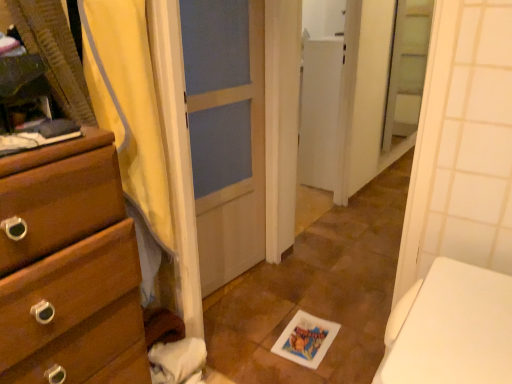
Question: Looking at their shapes, would you say wooden chest of drawers at left is wider or thinner than yellow fabric shower curtain at left?

Choices:
 (A) thin
 (B) wide

Answer: (B)

Question: Is point (117, 226) closer or farther from the camera than point (130, 140)?

Choices:
 (A) farther
 (B) closer

Answer: (B)

Question: Which object is the farthest from the yellow fabric shower curtain at left?

Choices:
 (A) wooden chest of drawers at left
 (B) clear glass screen door at upper right

Answer: (B)

Question: Considering the real-world distances, which object is closest to the clear glass screen door at upper right?

Choices:
 (A) yellow fabric shower curtain at left
 (B) wooden chest of drawers at left

Answer: (A)